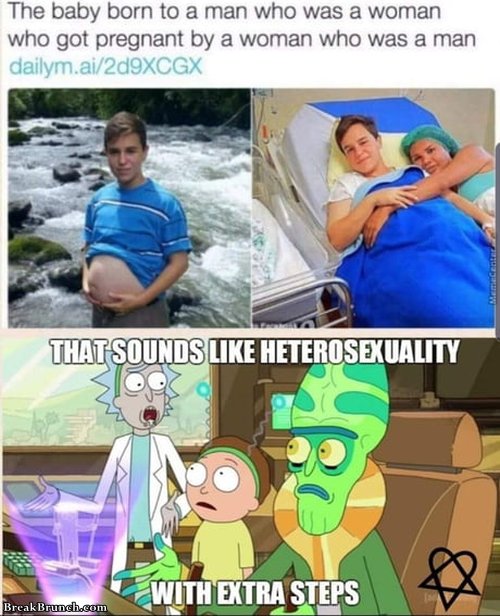
The image size is (500, 616). Find the location of `chair`. chair is located at coordinates (408, 527).